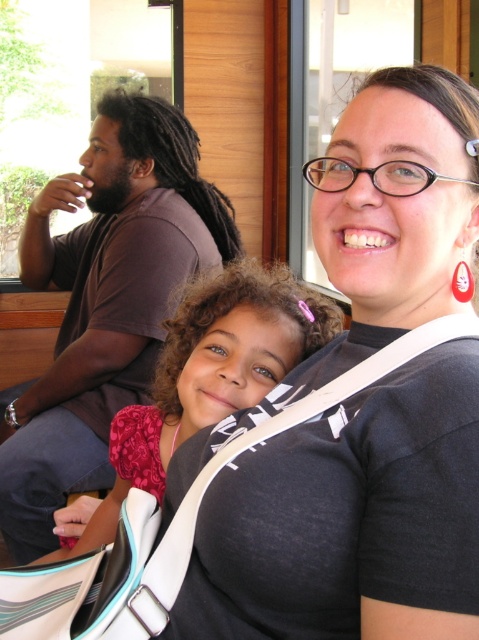
Question: Can you confirm if black matte shirt at center is positioned below pink fabric at center?

Choices:
 (A) no
 (B) yes

Answer: (A)

Question: Among these objects, which one is farthest from the camera?

Choices:
 (A) black matte shirt at center
 (B) brown cotton shirt at left
 (C) pink fabric at center

Answer: (B)

Question: Considering the real-world distances, which object is farthest from the pink fabric at center?

Choices:
 (A) black matte shirt at center
 (B) brown cotton shirt at left

Answer: (B)

Question: Which point appears closest to the camera in this image?

Choices:
 (A) (335, 321)
 (B) (331, 499)
 (C) (151, 100)

Answer: (B)

Question: Does black matte shirt at center have a smaller size compared to brown cotton shirt at left?

Choices:
 (A) yes
 (B) no

Answer: (A)

Question: Is black matte shirt at center smaller than brown cotton shirt at left?

Choices:
 (A) no
 (B) yes

Answer: (B)